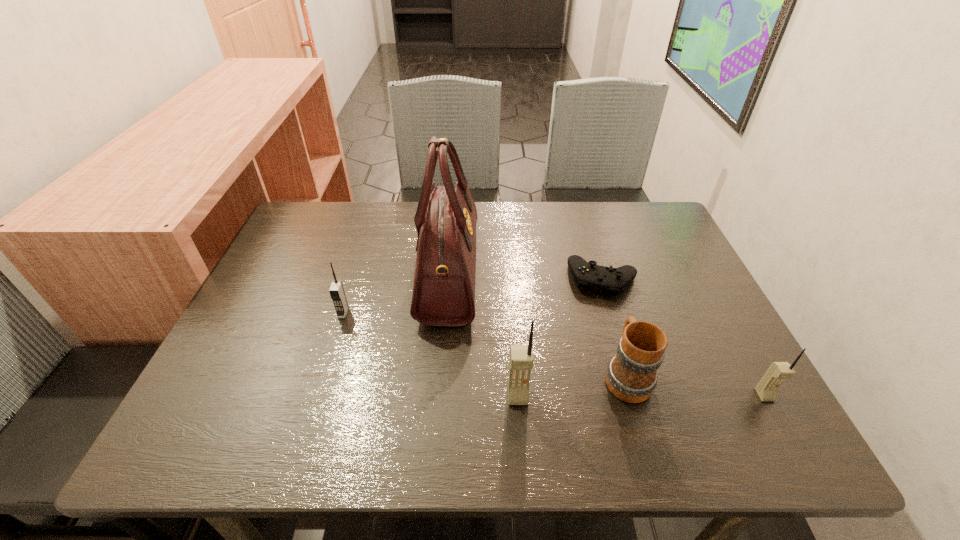
Where is `the second cellular telephone from left to right`? Image resolution: width=960 pixels, height=540 pixels. the second cellular telephone from left to right is located at coordinates (521, 359).

Identify the location of the fourth object from right to left. This screenshot has width=960, height=540. (521, 359).

Where is `the rightmost object`? The image size is (960, 540). the rightmost object is located at coordinates (766, 389).

Image resolution: width=960 pixels, height=540 pixels. Identify the location of the tallest object. (444, 282).

At what (x,y) coordinates should I click in order to perform the action: click on handbag. Please return your answer as a coordinate pair (x, y). Looking at the image, I should click on (444, 282).

Identify the location of the shortest object. (613, 281).

The height and width of the screenshot is (540, 960). In order to click on the leftmost object in this screenshot , I will do `click(337, 293)`.

I want to click on the leftmost cellular telephone, so (337, 293).

Identify the location of mug. This screenshot has height=540, width=960. (631, 376).

In order to click on vacant space located 0.100m on the front-facing side of the handbag in this screenshot , I will do `click(516, 273)`.